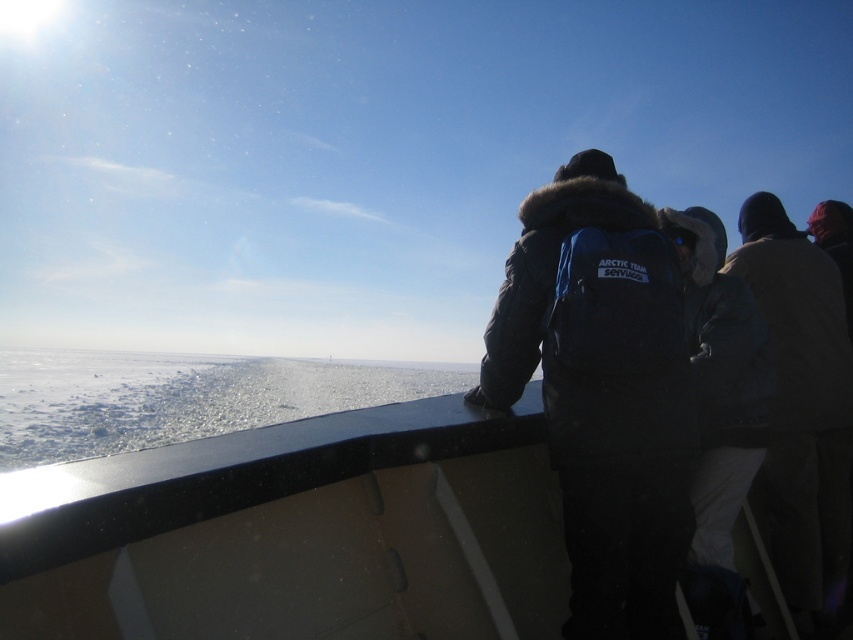
Question: Is dark blue puffy jacket at center positioned at the back of dark brown jacket at upper right?

Choices:
 (A) yes
 (B) no

Answer: (B)

Question: Is white ice at lower left to the right of dark brown jacket at upper right from the viewer's perspective?

Choices:
 (A) no
 (B) yes

Answer: (A)

Question: Among these objects, which one is nearest to the camera?

Choices:
 (A) smooth black boat at center
 (B) dark gray fur-lined jacket at center

Answer: (A)

Question: Among these points, which one is farthest from the camera?

Choices:
 (A) (303, 364)
 (B) (267, 570)

Answer: (A)

Question: Is smooth black boat at center to the left of dark gray fur-lined jacket at center from the viewer's perspective?

Choices:
 (A) yes
 (B) no

Answer: (A)

Question: Which point is farther to the camera?

Choices:
 (A) dark gray fur-lined jacket at center
 (B) dark brown jacket at upper right

Answer: (B)